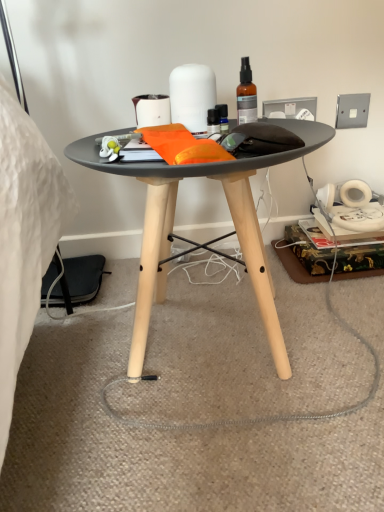
Locate an element on the screen. This screenshot has height=512, width=384. vacant space in front of matte black table at center is located at coordinates (214, 459).